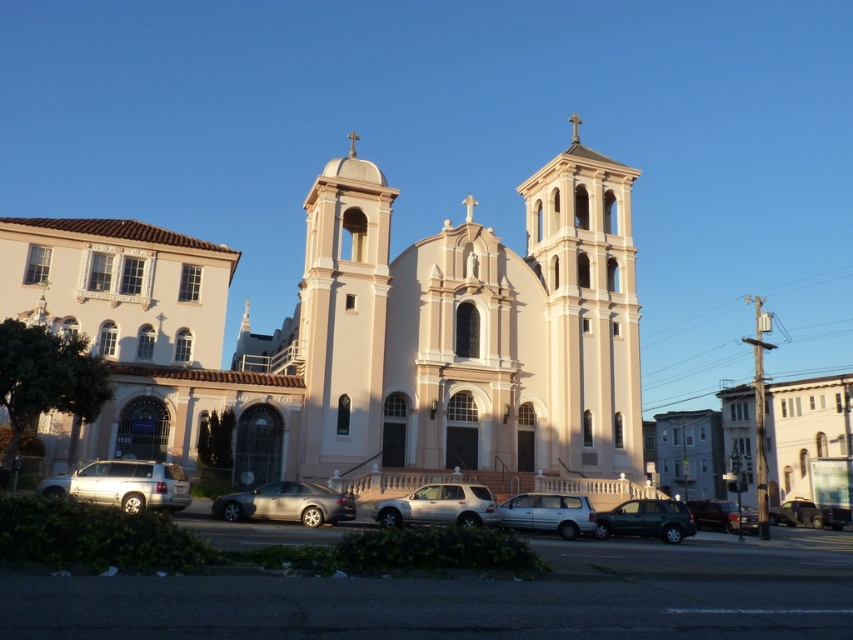
Who is lower down, satin silver suv at center or metallic silver truck at lower right?

metallic silver truck at lower right is lower down.

Which is in front, point (415, 516) or point (770, 520)?

Positioned in front is point (415, 516).

The height and width of the screenshot is (640, 853). Find the location of `satin silver suv at center`. satin silver suv at center is located at coordinates (438, 506).

Who is shorter, satin silver sedan at center or matte black suv at center?

satin silver sedan at center

Can you confirm if satin silver sedan at center is shorter than matte black suv at center?

Indeed, satin silver sedan at center has a lesser height compared to matte black suv at center.

Who is more distant from viewer, (276, 481) or (643, 531)?

The point (276, 481) is more distant.

Where is `satin silver sedan at center`? satin silver sedan at center is located at coordinates (286, 502).

Does point (421, 298) lie behind point (813, 508)?

No.

The height and width of the screenshot is (640, 853). In order to click on smooth beige church at center in this screenshot , I will do `click(363, 336)`.